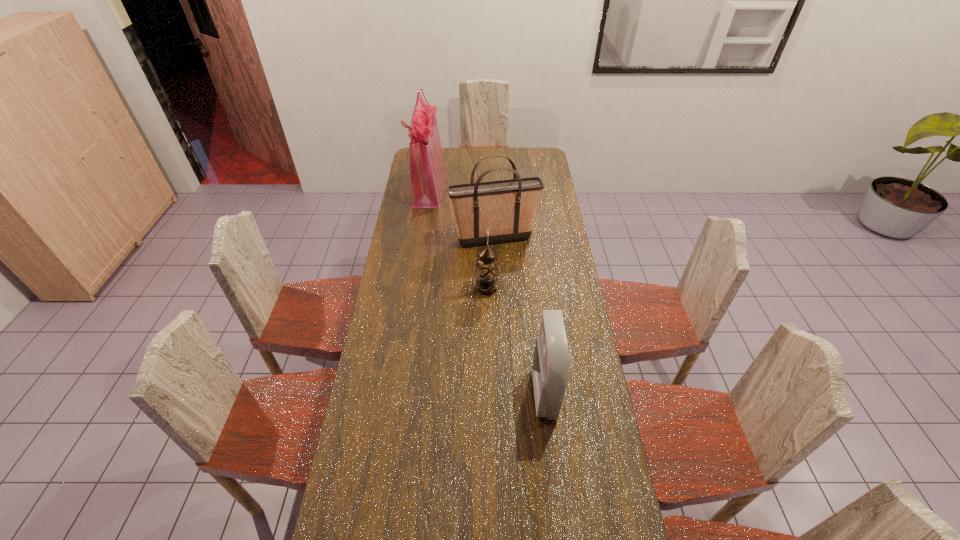
At what (x,y) coordinates should I click in order to perform the action: click on vacant space situated on the front-facing side of the nearest object. Please return your answer as a coordinate pair (x, y). Image resolution: width=960 pixels, height=540 pixels. Looking at the image, I should click on (474, 394).

The width and height of the screenshot is (960, 540). Find the location of `vacant region located on the back of the oil lamp`. vacant region located on the back of the oil lamp is located at coordinates (487, 235).

You are a GUI agent. You are given a task and a screenshot of the screen. Output one action in this format:
    pyautogui.click(x=<x>, y=<y>)
    Task: Click on the object that is at the left edge
    
    Given the screenshot: What is the action you would take?
    pyautogui.click(x=427, y=168)

Find the location of a particular element. The image size is (960, 540). shopping bag present at the right edge is located at coordinates (507, 207).

Find the location of a particular element. The width and height of the screenshot is (960, 540). the first-aid kit that is at the right edge is located at coordinates (551, 365).

The width and height of the screenshot is (960, 540). I want to click on vacant space at the far edge of the desktop, so click(478, 168).

I want to click on vacant area at the left edge of the desktop, so click(410, 201).

Where is `free spot at the right edge of the desktop`? This screenshot has height=540, width=960. free spot at the right edge of the desktop is located at coordinates (590, 360).

I want to click on free area in between the nearest object and the second nearest object, so click(516, 341).

Find the location of a particular element. vacant space that's between the nearest object and the third nearest object is located at coordinates (519, 317).